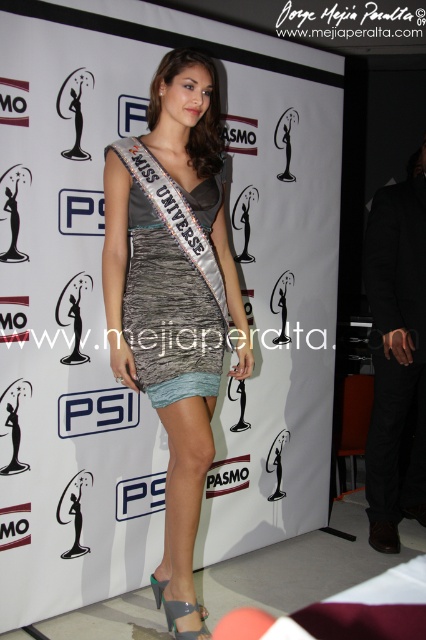
Question: Considering the real-world distances, which object is closest to the shiny metallic dress at center?

Choices:
 (A) shiny metallic sandal at lower center
 (B) satin dress at center

Answer: (B)

Question: Which object is closer to the camera taking this photo?

Choices:
 (A) shiny metallic sandal at lower center
 (B) shiny gray sandal at lower center
 (C) satin dress at center

Answer: (C)

Question: Considering the relative positions of satin dress at center and shiny metallic dress at center in the image provided, where is satin dress at center located with respect to shiny metallic dress at center?

Choices:
 (A) below
 (B) above

Answer: (A)

Question: Among these points, which one is nearest to the camera?

Choices:
 (A) (169, 628)
 (B) (203, 620)

Answer: (A)

Question: Does shiny gray sandal at lower center appear on the left side of shiny metallic sandal at lower center?

Choices:
 (A) no
 (B) yes

Answer: (B)

Question: Does satin dress at center have a larger size compared to shiny metallic sandal at lower center?

Choices:
 (A) no
 (B) yes

Answer: (B)